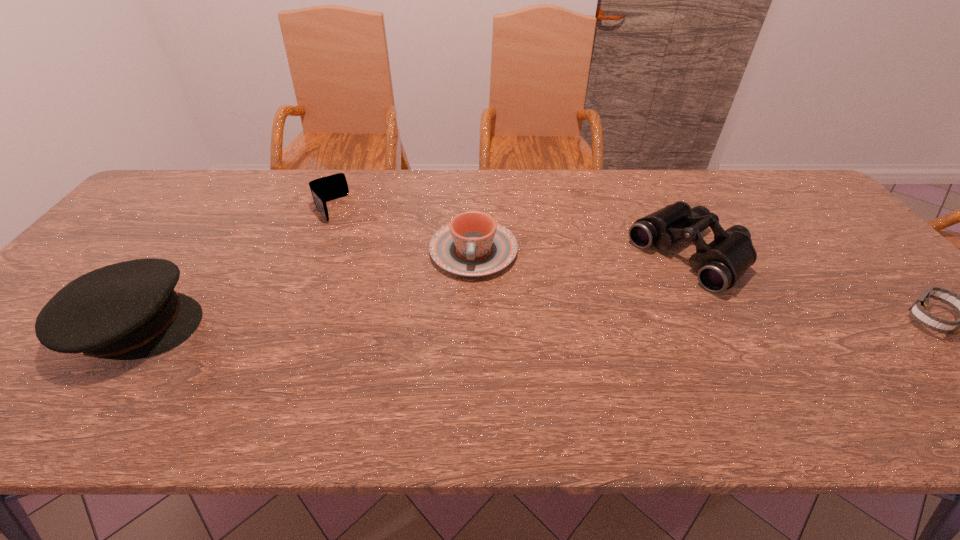
Where is `vacant region located on the front-facing side of the second object from right to left`? vacant region located on the front-facing side of the second object from right to left is located at coordinates (611, 313).

Where is `vacant space located 0.270m on the handle side of the chinaware`? Image resolution: width=960 pixels, height=540 pixels. vacant space located 0.270m on the handle side of the chinaware is located at coordinates (459, 371).

This screenshot has height=540, width=960. I want to click on blank area located 0.150m on the handle side of the chinaware, so click(465, 327).

I want to click on free space located 0.290m on the handle side of the chinaware, so click(458, 380).

I want to click on object present at the far edge, so click(328, 188).

Where is `object at the near edge`? The width and height of the screenshot is (960, 540). object at the near edge is located at coordinates (129, 310).

Locate an element on the screen. Image resolution: width=960 pixels, height=540 pixels. object situated at the left edge is located at coordinates (129, 310).

Find the location of a particular element. The height and width of the screenshot is (540, 960). object present at the near left corner is located at coordinates (129, 310).

Find the location of `free point at the far edge`. free point at the far edge is located at coordinates (390, 191).

At what (x,y) coordinates should I click in order to perform the action: click on vacant region at the near edge of the desktop. Please return your answer as a coordinate pair (x, y). This screenshot has height=540, width=960. Looking at the image, I should click on (189, 360).